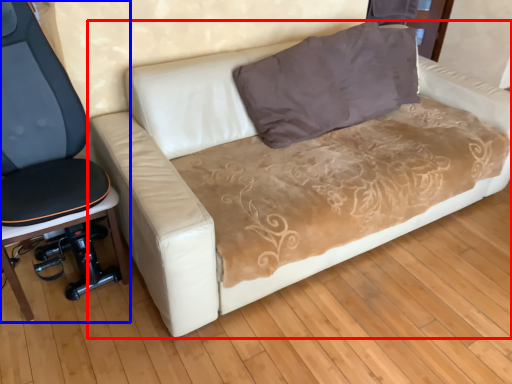
Question: Among these objects, which one is nearest to the camera, studio couch (highlighted by a red box) or furniture (highlighted by a blue box)?

Choices:
 (A) studio couch
 (B) furniture

Answer: (A)